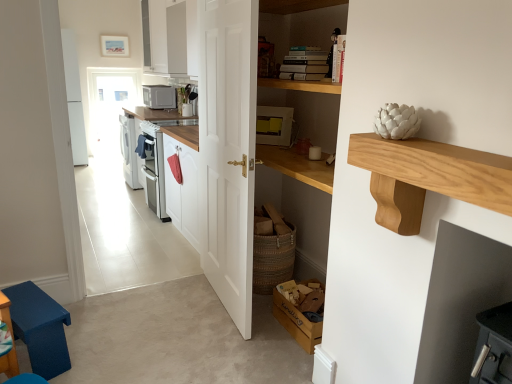
You are a GUI agent. You are given a task and a screenshot of the screen. Output one action in this format:
    pyautogui.click(x=<x>, y=<y>)
    Task: Click on the free space in front of wooden cardboard box at lower center
    This screenshot has height=384, width=512.
    Given the screenshot: What is the action you would take?
    pyautogui.click(x=287, y=359)